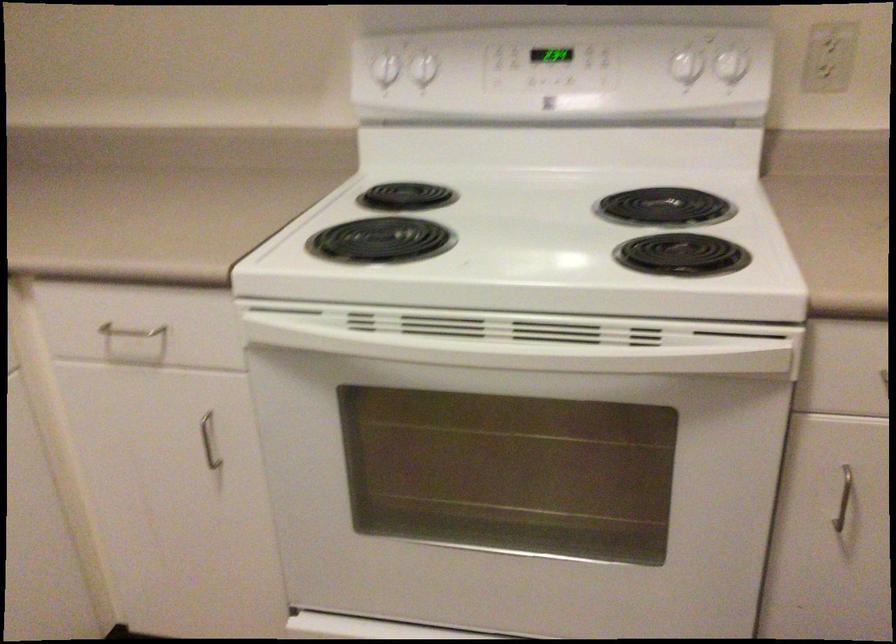
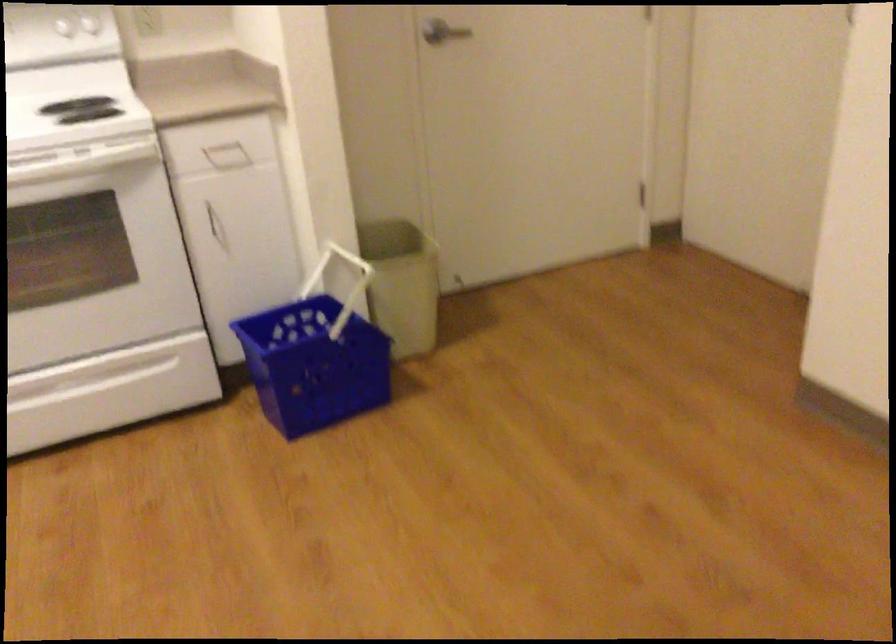
The point at (703, 67) is marked in the first image. Where is the corresponding point in the second image?

(80, 26)